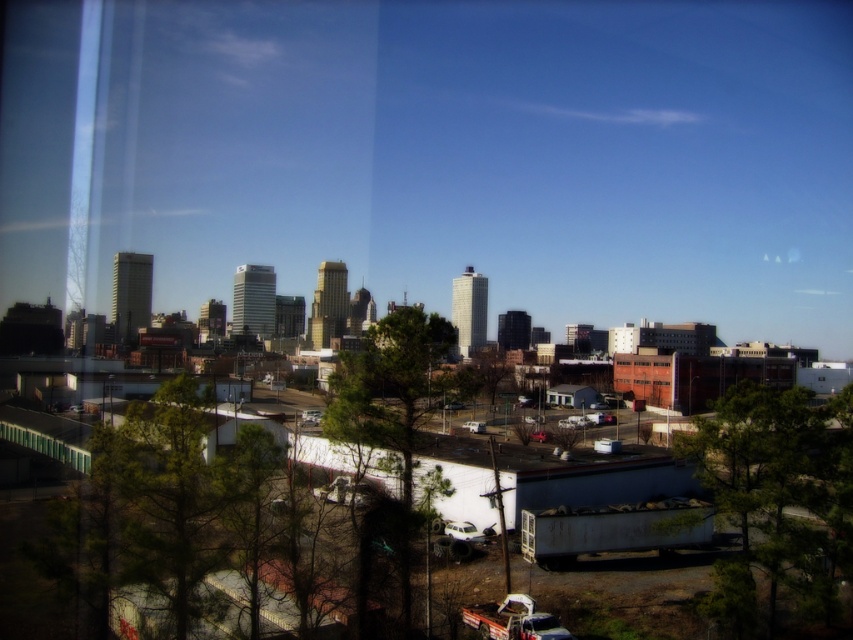
Which is more to the right, green matte tree at right or green leafy tree at center?

green matte tree at right

The image size is (853, 640). Identify the location of green matte tree at right. (778, 499).